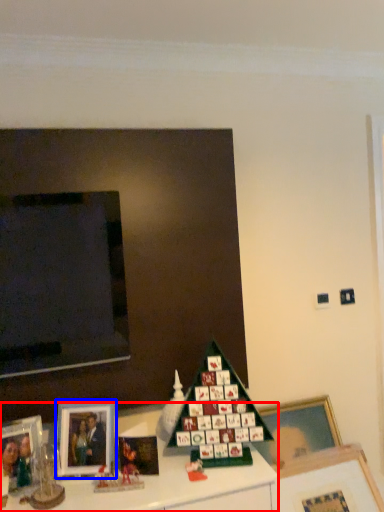
Question: Among these objects, which one is farthest to the camera, furniture (highlighted by a red box) or picture frame (highlighted by a blue box)?

Choices:
 (A) furniture
 (B) picture frame

Answer: (B)